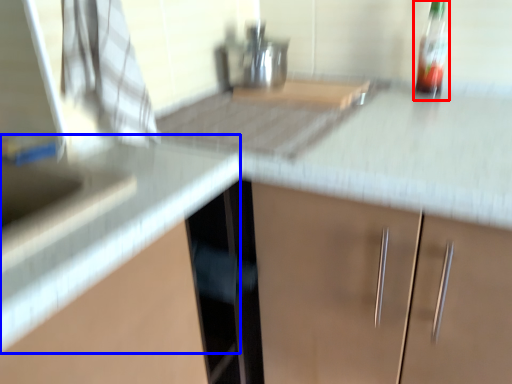
Question: Which of the following is the farthest to the observer, bottle (highlighted by a red box) or counter top (highlighted by a blue box)?

Choices:
 (A) bottle
 (B) counter top

Answer: (A)